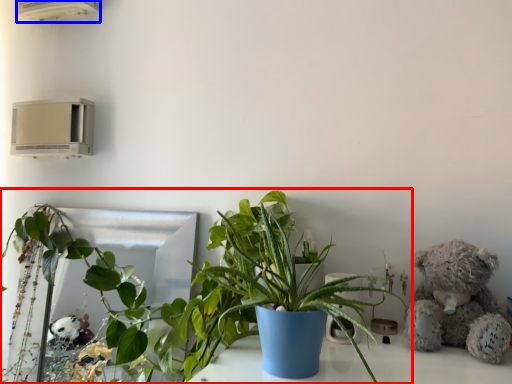
Question: Among these objects, which one is nearest to the camera, houseplant (highlighted by a red box) or air conditioning (highlighted by a blue box)?

Choices:
 (A) houseplant
 (B) air conditioning

Answer: (A)